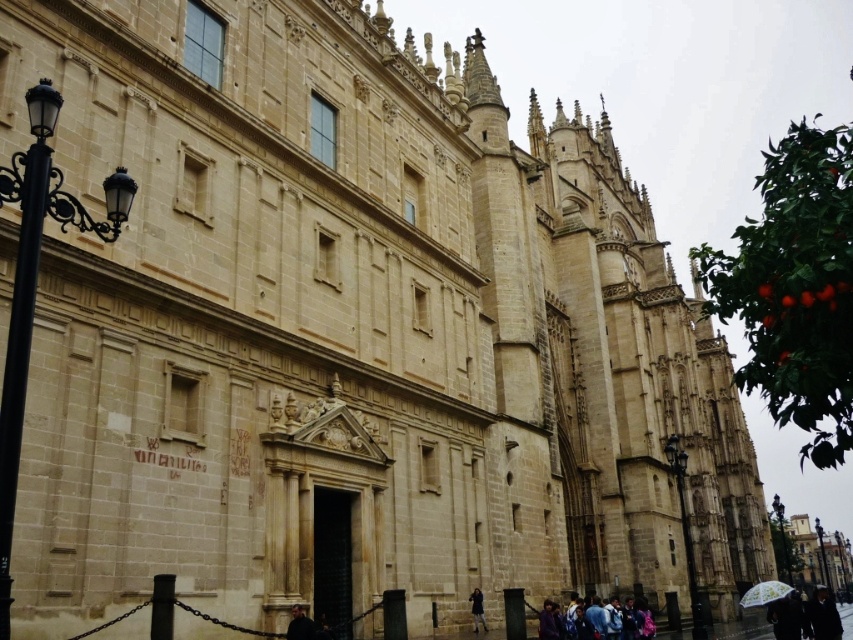
Is white lace umbrella at lower right below dark gray fabric jacket at lower center?

Yes, white lace umbrella at lower right is below dark gray fabric jacket at lower center.

Does white lace umbrella at lower right appear over dark gray fabric jacket at lower center?

Actually, white lace umbrella at lower right is below dark gray fabric jacket at lower center.

Is point (744, 600) behind point (300, 612)?

Yes.

What are the coordinates of `white lace umbrella at lower right` in the screenshot? It's located at (764, 593).

Who is more forward, (x=782, y=392) or (x=775, y=593)?

Point (x=782, y=392)

Is green leafy tree with small orange fruits at right shorter than white lace umbrella at lower right?

Incorrect, green leafy tree with small orange fruits at right's height does not fall short of white lace umbrella at lower right's.

Who is more distant from viewer, (801,160) or (767,602)?

Positioned behind is point (767,602).

You are a GUI agent. You are given a task and a screenshot of the screen. Output one action in this format:
    pyautogui.click(x=<x>, y=<y>)
    Task: Click on the green leafy tree with small orange fruits at right
    This screenshot has height=640, width=853.
    Given the screenshot: What is the action you would take?
    pyautogui.click(x=795, y=288)

Is green leafy tree with small orange fruits at right smaller than dark gray fabric jacket at lower center?

No.

Does green leafy tree with small orange fruits at right appear under dark gray fabric jacket at lower center?

Actually, green leafy tree with small orange fruits at right is above dark gray fabric jacket at lower center.

Is point (850, 346) farther from viewer compared to point (293, 618)?

No, it is not.

At what (x,y) coordinates should I click in order to perform the action: click on green leafy tree with small orange fruits at right. Please return your answer as a coordinate pair (x, y). Image resolution: width=853 pixels, height=640 pixels. Looking at the image, I should click on (795, 288).